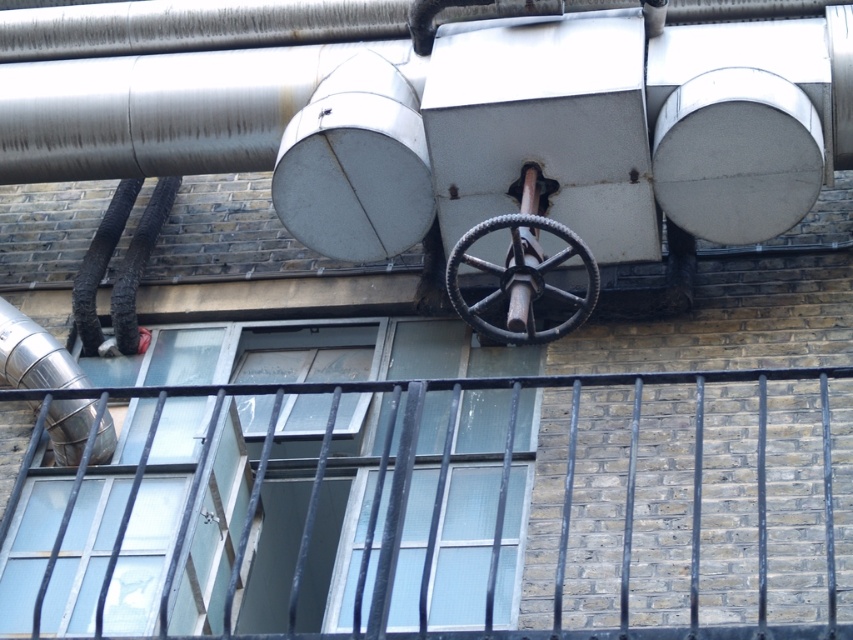
You are a maintenance worker needing to reach both the black metal railing at center and the brushed metal water pipe at left for inspection. Given that your ladder is 5 meters long, can you safely use it to access both objects without moving the ladder?

The black metal railing at center and the brushed metal water pipe at left are 5.10 meters apart. Since the ladder is only 5 meters long, it is too short to span the distance between the two objects safely. You will need a longer ladder or an alternative method to access both areas.

You are a maintenance worker inspecting the building exterior. You notice the black metal railing at center and the brushed metal water pipe at left. Which object should you prioritize checking for potential safety issues based on their size?

The black metal railing at center should be prioritized for inspection because it is larger in size than the brushed metal water pipe at left, making it more critical for structural integrity.